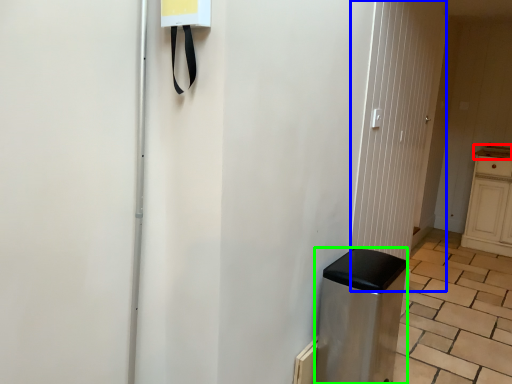
Question: Considering the real-world distances, which object is closest to counter top (highlighted by a red box)? screen door (highlighted by a blue box) or appliance (highlighted by a green box).

Choices:
 (A) screen door
 (B) appliance

Answer: (A)